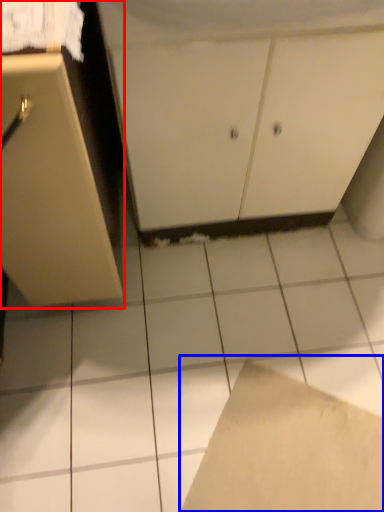
Question: Which object is closer to the camera taking this photo, cabinetry (highlighted by a red box) or cardboard (highlighted by a blue box)?

Choices:
 (A) cabinetry
 (B) cardboard

Answer: (A)